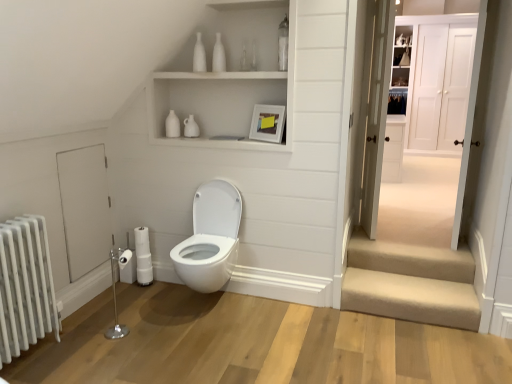
Question: Considering the relative sizes of white matte toilet paper at lower left and beige carpeted stairs at lower right in the image provided, is white matte toilet paper at lower left thinner than beige carpeted stairs at lower right?

Choices:
 (A) yes
 (B) no

Answer: (A)

Question: Can you confirm if white matte toilet paper at lower left is smaller than beige carpeted stairs at lower right?

Choices:
 (A) yes
 (B) no

Answer: (A)

Question: Can you confirm if white matte toilet paper at lower left is positioned to the left of beige carpeted stairs at lower right?

Choices:
 (A) yes
 (B) no

Answer: (A)

Question: Is white matte toilet paper at lower left further to camera compared to beige carpeted stairs at lower right?

Choices:
 (A) no
 (B) yes

Answer: (B)

Question: Does white matte toilet paper at lower left lie in front of beige carpeted stairs at lower right?

Choices:
 (A) yes
 (B) no

Answer: (B)

Question: Considering the relative sizes of white matte toilet paper at lower left and beige carpeted stairs at lower right in the image provided, is white matte toilet paper at lower left shorter than beige carpeted stairs at lower right?

Choices:
 (A) yes
 (B) no

Answer: (B)

Question: Is white matte door at left, the first door in the left-to-right sequence, further to the viewer compared to white wood door at upper right, which is the first door from back to front?

Choices:
 (A) yes
 (B) no

Answer: (B)

Question: Is white matte door at left, marked as the 4th door in a back-to-front arrangement, positioned with its back to white wood door at upper right, which ranks as the fourth door in left-to-right order?

Choices:
 (A) yes
 (B) no

Answer: (B)

Question: Is white matte door at left, the first door in the left-to-right sequence, shorter than white wood door at upper right, which ranks as the fourth door in left-to-right order?

Choices:
 (A) yes
 (B) no

Answer: (A)

Question: Is white matte door at left, marked as the 4th door in a back-to-front arrangement, thinner than white wood door at upper right, the first door viewed from the right?

Choices:
 (A) no
 (B) yes

Answer: (B)

Question: Is white matte door at left, marked as the 4th door in a back-to-front arrangement, bigger than white wood door at upper right, the first door viewed from the right?

Choices:
 (A) no
 (B) yes

Answer: (A)

Question: Is white matte door at left, positioned as the first door in front-to-back order, not close to white wood door at upper right, which is the first door from back to front?

Choices:
 (A) no
 (B) yes

Answer: (B)

Question: Is white glossy door at right, the 3th door positioned from the back, wider than white wood door at upper right, which is the first door from back to front?

Choices:
 (A) yes
 (B) no

Answer: (A)